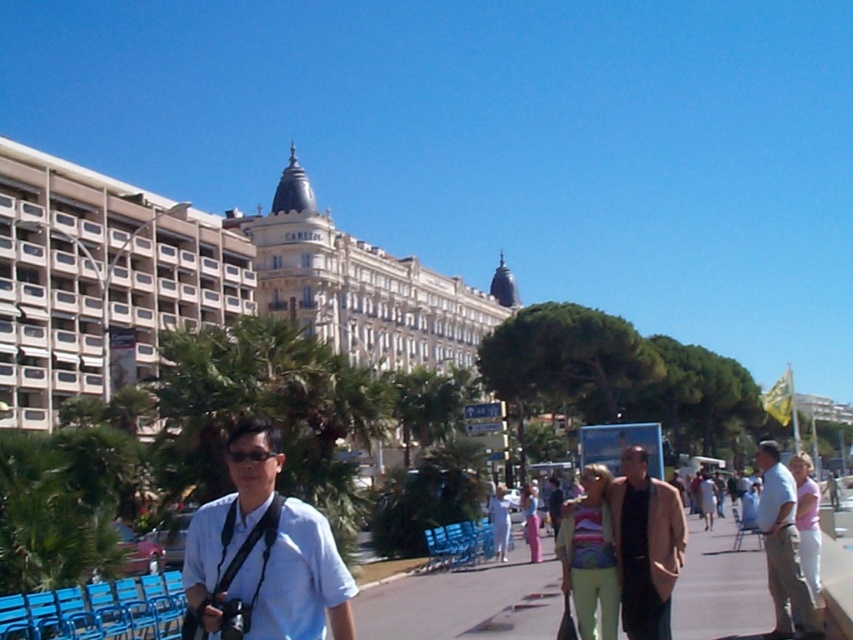
Question: Can you confirm if white matte shirt at center is smaller than black plastic sunglasses at center?

Choices:
 (A) no
 (B) yes

Answer: (A)

Question: Can you confirm if white stone building at center is positioned to the left of white matte shirt at center?

Choices:
 (A) no
 (B) yes

Answer: (A)

Question: Which object is closer to the camera taking this photo?

Choices:
 (A) smooth concrete sidewalk at center
 (B) pink fabric pants at lower right
 (C) white textured building at upper left
 (D) dark brown leather jacket at center

Answer: (A)

Question: Which point is closer to the camera?

Choices:
 (A) smooth concrete sidewalk at center
 (B) white textured building at upper left
 (C) black plastic sunglasses at center

Answer: (A)

Question: Which point is farther from the camera taking this photo?

Choices:
 (A) (x=473, y=588)
 (B) (x=648, y=493)

Answer: (A)

Question: Is smooth concrete sidewalk at center positioned in front of dark brown leather jacket at center?

Choices:
 (A) yes
 (B) no

Answer: (A)